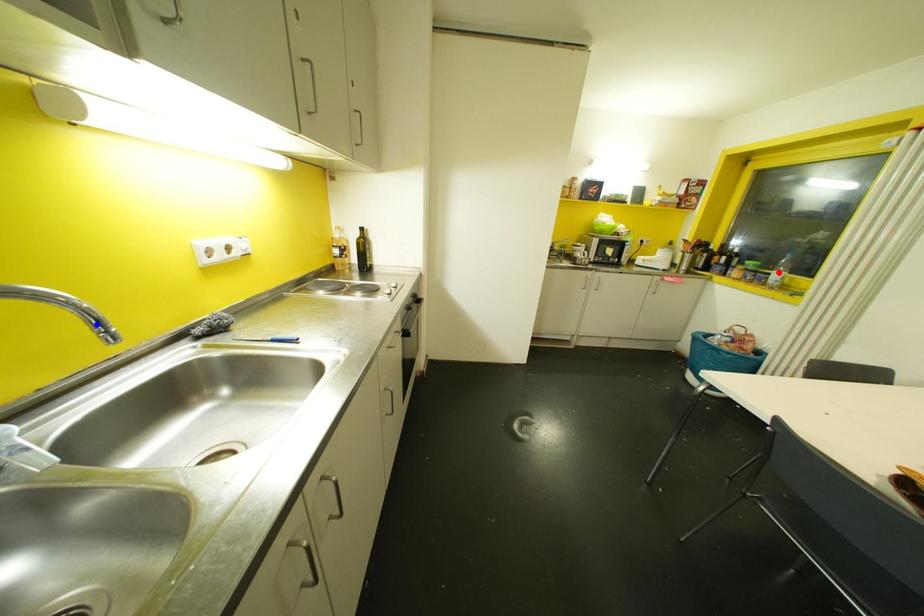
Question: Two points are marked on the image. Which point is closer to the camera?

Choices:
 (A) Blue point is closer.
 (B) Red point is closer.

Answer: (A)